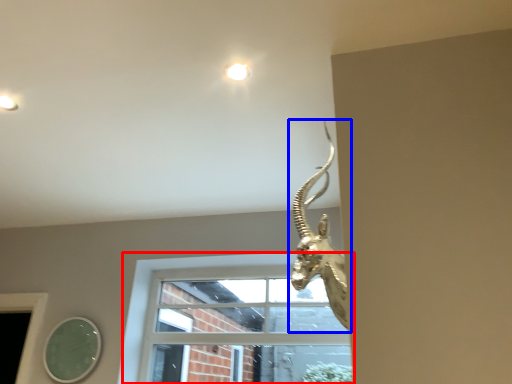
Question: Which of the following is the farthest to the observer, window (highlighted by a red box) or animal (highlighted by a blue box)?

Choices:
 (A) window
 (B) animal

Answer: (A)